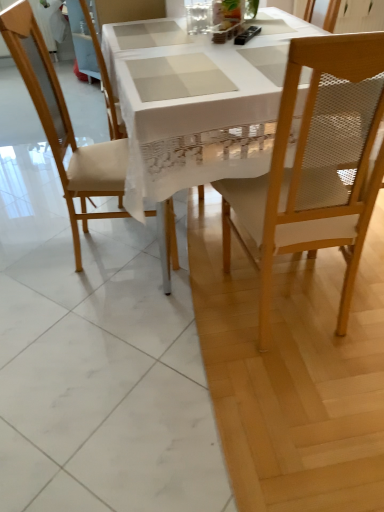
Question: Which is correct: black plastic remote control at upper center is inside matte wood chair at left, which is the first chair from left to right, or outside of it?

Choices:
 (A) inside
 (B) outside

Answer: (B)

Question: Would you say black plastic remote control at upper center is to the left or to the right of matte wood chair at left, which is the first chair from left to right, in the picture?

Choices:
 (A) left
 (B) right

Answer: (B)

Question: Estimate the real-world distances between objects in this image. Which object is closer to the light wood mesh chair at right, placed as the 3th chair when sorted from left to right?

Choices:
 (A) black plastic remote control at upper center
 (B) matte wood chair at left, which is the first chair from left to right
 (C) beige fabric chair at center, which is the 2th chair in right-to-left order
 (D) white lace tablecloth at center

Answer: (D)

Question: Which of these objects is positioned farthest from the black plastic remote control at upper center?

Choices:
 (A) white lace tablecloth at center
 (B) beige fabric chair at center, which is the 2th chair in right-to-left order
 (C) matte wood chair at left, placed as the 3th chair when sorted from right to left
 (D) light wood mesh chair at right, placed as the 3th chair when sorted from left to right

Answer: (D)